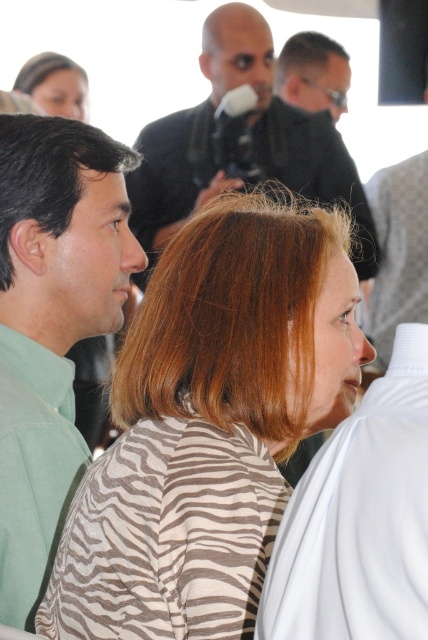
You are a photographer trying to capture a clear shot of the blonde hair at center and the black matte microphone at upper center. Which object should you focus on first to ensure both are in focus?

Since the blonde hair at center is closer to the viewer than the black matte microphone at upper center, you should focus on the blonde hair at center first. This way, the depth of field will extend towards the microphone, increasing the chances of both being in focus.

You are attending a presentation and notice two items in the front of the room. One is the black matte microphone at upper center and the other is the zebra print scarf at upper left. From your perspective, which item is positioned to the right side?

The black matte microphone at upper center is positioned to the right of the zebra print scarf at upper left.